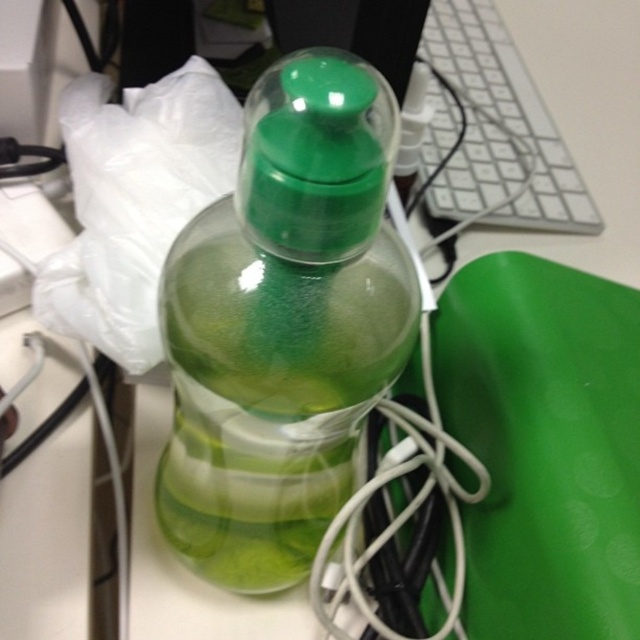
Question: Among these points, which one is farthest from the camera?

Choices:
 (A) (364, 284)
 (B) (509, 83)

Answer: (B)

Question: Can you confirm if transparent plastic bottle at center is smaller than white plastic keyboard at upper right?

Choices:
 (A) yes
 (B) no

Answer: (A)

Question: Can you confirm if transparent plastic bottle at center is positioned below white plastic keyboard at upper right?

Choices:
 (A) yes
 (B) no

Answer: (A)

Question: Is transparent plastic bottle at center wider than white plastic keyboard at upper right?

Choices:
 (A) yes
 (B) no

Answer: (B)